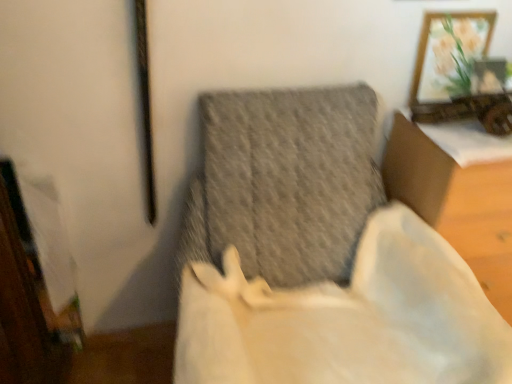
In order to click on white fabric cushion at center, acting as the second furniture starting from the left in this screenshot , I will do `click(456, 204)`.

Locate an element on the screen. The height and width of the screenshot is (384, 512). textured gray cushion at center, the first furniture from the left is located at coordinates (319, 257).

Relative to wooden framed artwork at upper right, is textured gray cushion at center, the first furniture from the left, in front or behind?

Visually, textured gray cushion at center, the first furniture from the left, is located in front of wooden framed artwork at upper right.

Does textured gray cushion at center, the second furniture viewed from the right, have a larger size compared to wooden framed artwork at upper right?

Yes.

Identify the location of picture frame that appears above the textured gray cushion at center, the second furniture viewed from the right (from a real-world perspective). The width and height of the screenshot is (512, 384). [446, 56].

In the scene shown: From the image's perspective, is white fabric cushion at center, the first furniture from the right, located beneath textured gray cushion at center, the second furniture viewed from the right?

No, from the image's perspective, white fabric cushion at center, the first furniture from the right, is not beneath textured gray cushion at center, the second furniture viewed from the right.

From a real-world perspective, is white fabric cushion at center, acting as the second furniture starting from the left, physically below textured gray cushion at center, the first furniture from the left?

Yes, from a real-world perspective, white fabric cushion at center, acting as the second furniture starting from the left, is beneath textured gray cushion at center, the first furniture from the left.

Considering the relative positions of white fabric cushion at center, the first furniture from the right, and textured gray cushion at center, the first furniture from the left, in the image provided, is white fabric cushion at center, the first furniture from the right, behind textured gray cushion at center, the first furniture from the left,?

Yes, it is.

Is textured gray cushion at center, the second furniture viewed from the right, inside white fabric cushion at center, the first furniture from the right?

Definitely not — textured gray cushion at center, the second furniture viewed from the right, is not inside white fabric cushion at center, the first furniture from the right.

Would you say wooden framed artwork at upper right is to the left or to the right of white fabric cushion at center, acting as the second furniture starting from the left, in the picture?

wooden framed artwork at upper right is to the left of white fabric cushion at center, acting as the second furniture starting from the left.

How many degrees apart are the facing directions of wooden framed artwork at upper right and white fabric cushion at center, the first furniture from the right?

They differ by 0.289 degrees in their facing directions.

From a real-world perspective, between wooden framed artwork at upper right and white fabric cushion at center, acting as the second furniture starting from the left, who is vertically lower?

In real-world perspective, white fabric cushion at center, acting as the second furniture starting from the left, is lower.

Considering the relative sizes of wooden framed artwork at upper right and white fabric cushion at center, acting as the second furniture starting from the left, in the image provided, is wooden framed artwork at upper right taller than white fabric cushion at center, acting as the second furniture starting from the left,?

Incorrect, the height of wooden framed artwork at upper right is not larger of that of white fabric cushion at center, acting as the second furniture starting from the left.

From the image's perspective, does white fabric cushion at center, the first furniture from the right, appear lower than wooden framed artwork at upper right?

Correct, white fabric cushion at center, the first furniture from the right, appears lower than wooden framed artwork at upper right in the image.

Between white fabric cushion at center, acting as the second furniture starting from the left, and wooden framed artwork at upper right, which one has more height?

With more height is white fabric cushion at center, acting as the second furniture starting from the left.

Is white fabric cushion at center, the first furniture from the right, surrounding wooden framed artwork at upper right?

No, wooden framed artwork at upper right is located outside of white fabric cushion at center, the first furniture from the right.

Can you confirm if white fabric cushion at center, the first furniture from the right, is wider than wooden framed artwork at upper right?

Correct, the width of white fabric cushion at center, the first furniture from the right, exceeds that of wooden framed artwork at upper right.

Is wooden framed artwork at upper right with textured gray cushion at center, the second furniture viewed from the right?

wooden framed artwork at upper right is not next to textured gray cushion at center, the second furniture viewed from the right, and they're not touching.

Who is shorter, wooden framed artwork at upper right or textured gray cushion at center, the first furniture from the left?

wooden framed artwork at upper right.

Which is behind, point (452, 42) or point (373, 308)?

The point (452, 42) is more distant.

Between wooden framed artwork at upper right and textured gray cushion at center, the second furniture viewed from the right, which one has smaller width?

wooden framed artwork at upper right is thinner.

From a real-world perspective, which is physically above, textured gray cushion at center, the first furniture from the left, or white fabric cushion at center, acting as the second furniture starting from the left?

From a 3D spatial view, textured gray cushion at center, the first furniture from the left, is above.

Is textured gray cushion at center, the second furniture viewed from the right, facing away from white fabric cushion at center, acting as the second furniture starting from the left?

No, white fabric cushion at center, acting as the second furniture starting from the left, is not at the back of textured gray cushion at center, the second furniture viewed from the right.

Which is more to the right, textured gray cushion at center, the second furniture viewed from the right, or white fabric cushion at center, acting as the second furniture starting from the left?

white fabric cushion at center, acting as the second furniture starting from the left.

Is textured gray cushion at center, the second furniture viewed from the right, next to white fabric cushion at center, acting as the second furniture starting from the left, and touching it?

No.

Locate an element on the screen. This screenshot has height=384, width=512. picture frame on the right of textured gray cushion at center, the first furniture from the left is located at coordinates (446, 56).

Find the location of `furniture above the textured gray cushion at center, the first furniture from the left (from the image's perspective)`. furniture above the textured gray cushion at center, the first furniture from the left (from the image's perspective) is located at coordinates (456, 204).

From the image, which object appears to be nearer to wooden framed artwork at upper right, textured gray cushion at center, the second furniture viewed from the right, or white fabric cushion at center, acting as the second furniture starting from the left?

white fabric cushion at center, acting as the second furniture starting from the left, lies closer to wooden framed artwork at upper right than the other object.

Considering their positions, is wooden framed artwork at upper right positioned closer to textured gray cushion at center, the first furniture from the left, than white fabric cushion at center, acting as the second furniture starting from the left?

Based on the image, white fabric cushion at center, acting as the second furniture starting from the left, appears to be nearer to textured gray cushion at center, the first furniture from the left.

From the image, which object appears to be farther from textured gray cushion at center, the second furniture viewed from the right, white fabric cushion at center, acting as the second furniture starting from the left, or wooden framed artwork at upper right?

wooden framed artwork at upper right.

Looking at the image, which one is located closer to white fabric cushion at center, acting as the second furniture starting from the left, wooden framed artwork at upper right or textured gray cushion at center, the second furniture viewed from the right?

wooden framed artwork at upper right is positioned closer to the anchor white fabric cushion at center, acting as the second furniture starting from the left.

Which object lies further to the anchor point wooden framed artwork at upper right, white fabric cushion at center, the first furniture from the right, or textured gray cushion at center, the second furniture viewed from the right?

textured gray cushion at center, the second furniture viewed from the right, is further to wooden framed artwork at upper right.

Based on their spatial positions, is textured gray cushion at center, the first furniture from the left, or wooden framed artwork at upper right closer to white fabric cushion at center, the first furniture from the right?

wooden framed artwork at upper right.

At what (x,y) coordinates should I click in order to perform the action: click on furniture located between textured gray cushion at center, the first furniture from the left, and wooden framed artwork at upper right in the depth direction. Please return your answer as a coordinate pair (x, y). The height and width of the screenshot is (384, 512). Looking at the image, I should click on (456, 204).